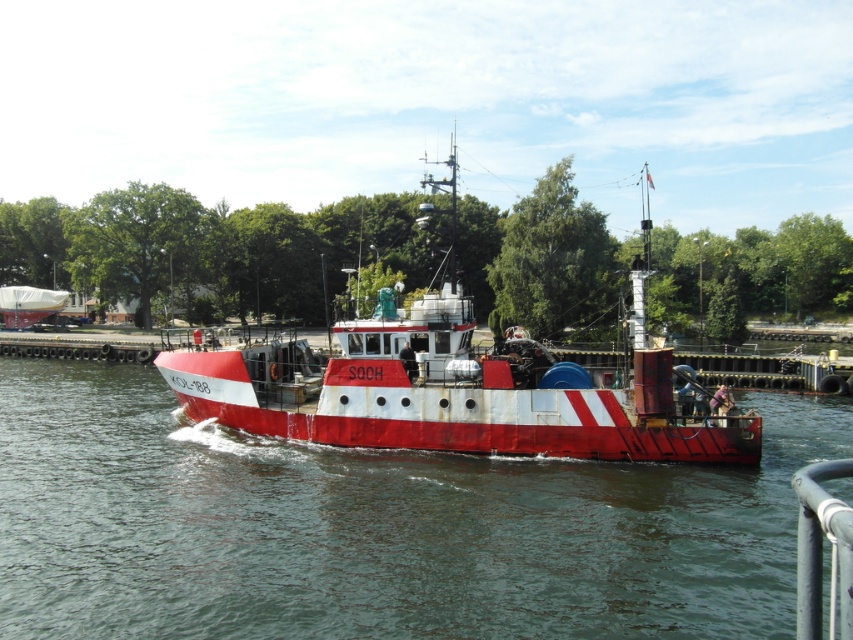
You are a sailor on the red and white fishing boat named SOCH. You notice there is smooth water at center and white tarpaulin boat at left. Which object is taller?

The white tarpaulin boat at left is taller than the smooth water at center.

You are standing on the deck of the red and white fishing boat named SOCH and looking towards the center of the boat. You see a point marked at coordinates (x=454, y=388). What object is located at that point?

The point at coordinates (x=454, y=388) marks the location of the rusty metal boat at center.

Based on the scene description, where is the rusty metal boat at center located in terms of its 2D coordinates?

The rusty metal boat at center is located at the 2D coordinates of point [454,388].